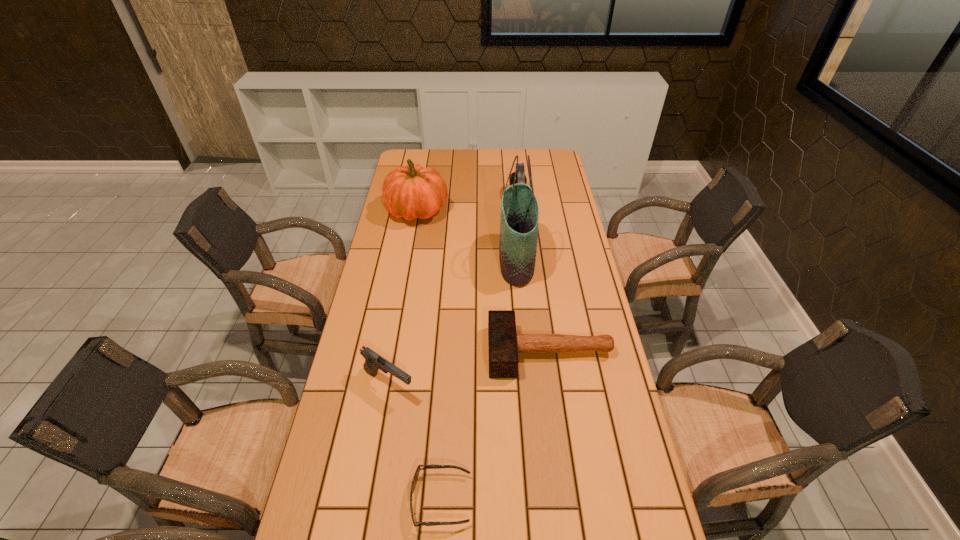
Where is `object that is at the right edge`? This screenshot has width=960, height=540. object that is at the right edge is located at coordinates (504, 344).

In the image, there is a desktop. Identify the location of free space at the far edge. (479, 153).

I want to click on vacant space at the left edge of the desktop, so click(313, 490).

You are a GUI agent. You are given a task and a screenshot of the screen. Output one action in this format:
    pyautogui.click(x=<x>, y=<y>)
    Task: Click on the vacant space at the right edge
    The width and height of the screenshot is (960, 540).
    Given the screenshot: What is the action you would take?
    pyautogui.click(x=600, y=363)

Where is `vacant space at the far right corner of the desktop`? vacant space at the far right corner of the desktop is located at coordinates (539, 166).

The height and width of the screenshot is (540, 960). I want to click on free space between the fourth nearest object and the fifth tallest object, so click(533, 306).

Locate an element on the screen. vacant area that lies between the second tallest object and the gun is located at coordinates (403, 298).

You are a GUI agent. You are given a task and a screenshot of the screen. Output one action in this format:
    pyautogui.click(x=<x>, y=<y>)
    Task: Click on the vacant region between the pumpkin and the third farthest object
    This screenshot has height=540, width=960.
    Given the screenshot: What is the action you would take?
    pyautogui.click(x=467, y=235)

At what (x,y) coordinates should I click in order to perform the action: click on free area in between the pumpkin and the nearest object. Please return your answer as a coordinate pair (x, y). Looking at the image, I should click on (429, 355).

Where is `empty space that is in between the earphone and the sunglasses`? This screenshot has height=540, width=960. empty space that is in between the earphone and the sunglasses is located at coordinates (480, 348).